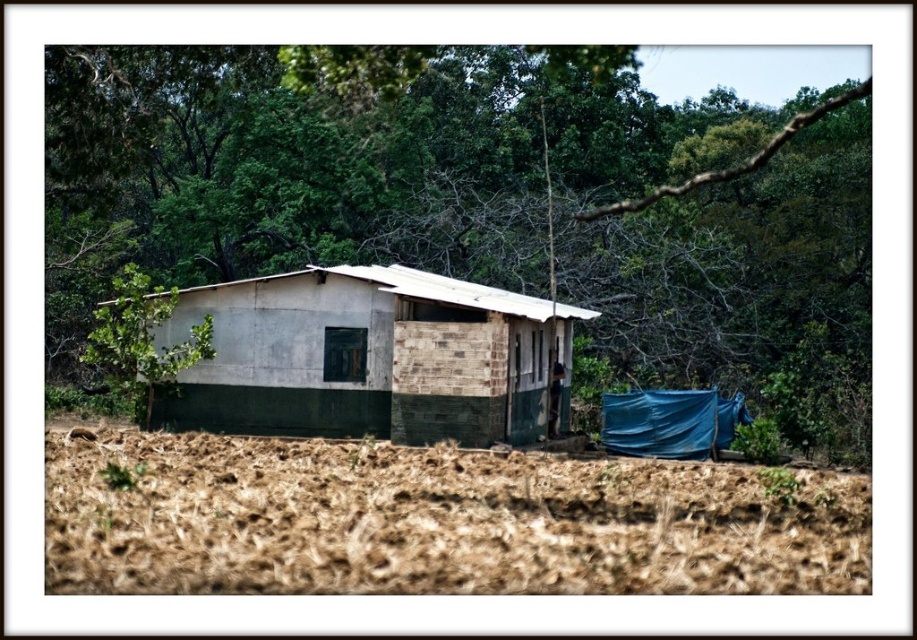
Does brown soil at lower center have a greater width compared to white concrete hut at center?

Yes.

Between brown soil at lower center and white concrete hut at center, which one has less height?

With less height is white concrete hut at center.

What do you see at coordinates (435, 520) in the screenshot? This screenshot has height=640, width=917. I see `brown soil at lower center` at bounding box center [435, 520].

Locate an element on the screen. This screenshot has height=640, width=917. brown soil at lower center is located at coordinates (435, 520).

How far apart are green leafy tree at upper center and brown soil at lower center?

green leafy tree at upper center and brown soil at lower center are 12.62 meters apart from each other.

Locate an element on the screen. green leafy tree at upper center is located at coordinates [470, 244].

Locate an element on the screen. This screenshot has height=640, width=917. green leafy tree at upper center is located at coordinates (470, 244).

What do you see at coordinates (470, 244) in the screenshot? Image resolution: width=917 pixels, height=640 pixels. I see `green leafy tree at upper center` at bounding box center [470, 244].

Which of these two, green leafy tree at upper center or white concrete hut at center, stands taller?

green leafy tree at upper center

You are a GUI agent. You are given a task and a screenshot of the screen. Output one action in this format:
    pyautogui.click(x=<x>, y=<y>)
    Task: Click on the green leafy tree at upper center
    This screenshot has height=640, width=917.
    Given the screenshot: What is the action you would take?
    pyautogui.click(x=470, y=244)

You are a GUI agent. You are given a task and a screenshot of the screen. Output one action in this format:
    pyautogui.click(x=<x>, y=<y>)
    Task: Click on the green leafy tree at upper center
    This screenshot has height=640, width=917.
    Given the screenshot: What is the action you would take?
    pyautogui.click(x=470, y=244)